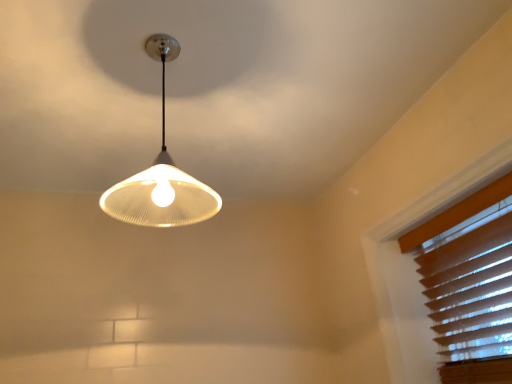
The image size is (512, 384). Describe the element at coordinates (161, 175) in the screenshot. I see `white matte lampshade at upper center` at that location.

Locate an element on the screen. This screenshot has width=512, height=384. white matte lampshade at upper center is located at coordinates (161, 175).

I want to click on brown wood blinds at upper right, so click(x=471, y=285).

Measure the distance between point (x=486, y=263) and camera.

The depth of point (x=486, y=263) is 1.40 meters.

Describe the element at coordinates (471, 285) in the screenshot. I see `brown wood blinds at upper right` at that location.

Where is `white matte lampshade at upper center`? This screenshot has height=384, width=512. white matte lampshade at upper center is located at coordinates (161, 175).

Does white matte lampshade at upper center appear on the left side of brown wood blinds at upper right?

Yes, white matte lampshade at upper center is to the left of brown wood blinds at upper right.

Is white matte lampshade at upper center closer to camera compared to brown wood blinds at upper right?

That is True.

Considering the positions of points (155, 184) and (497, 226), is point (155, 184) farther from camera compared to point (497, 226)?

No, it is in front of (497, 226).

From the image's perspective, is white matte lampshade at upper center above or below brown wood blinds at upper right?

white matte lampshade at upper center is above brown wood blinds at upper right.

From a real-world perspective, is white matte lampshade at upper center physically below brown wood blinds at upper right?

No, from a real-world perspective, white matte lampshade at upper center is not beneath brown wood blinds at upper right.

From the picture: Between white matte lampshade at upper center and brown wood blinds at upper right, which one has larger width?

With larger width is white matte lampshade at upper center.

In terms of height, does white matte lampshade at upper center look taller or shorter compared to brown wood blinds at upper right?

In the image, white matte lampshade at upper center appears to be shorter than brown wood blinds at upper right.

Based on the photo, considering the relative sizes of white matte lampshade at upper center and brown wood blinds at upper right in the image provided, is white matte lampshade at upper center bigger than brown wood blinds at upper right?

Yes, white matte lampshade at upper center is bigger than brown wood blinds at upper right.

Is white matte lampshade at upper center surrounding brown wood blinds at upper right?

That's incorrect, brown wood blinds at upper right is not inside white matte lampshade at upper center.

Based on the photo, is white matte lampshade at upper center in contact with brown wood blinds at upper right?

A: white matte lampshade at upper center and brown wood blinds at upper right are clearly separated.

Does white matte lampshade at upper center turn towards brown wood blinds at upper right?

No, white matte lampshade at upper center is not oriented towards brown wood blinds at upper right.

How distant is white matte lampshade at upper center from brown wood blinds at upper right?

The distance of white matte lampshade at upper center from brown wood blinds at upper right is 38.38 inches.

The height and width of the screenshot is (384, 512). In order to click on blind that appears below the white matte lampshade at upper center (from a real-world perspective) in this screenshot , I will do `click(471, 285)`.

Is brown wood blinds at upper right to the left of white matte lampshade at upper center from the viewer's perspective?

No.

Does brown wood blinds at upper right come in front of white matte lampshade at upper center?

That is False.

Is point (504, 288) closer or farther from the camera than point (210, 207)?

Point (504, 288) is positioned farther from the camera compared to point (210, 207).

From the image's perspective, is brown wood blinds at upper right beneath white matte lampshade at upper center?

Correct, brown wood blinds at upper right appears lower than white matte lampshade at upper center in the image.

From a real-world perspective, is brown wood blinds at upper right over white matte lampshade at upper center?

No, from a real-world perspective, brown wood blinds at upper right is not on top of white matte lampshade at upper center.

Is brown wood blinds at upper right wider than white matte lampshade at upper center?

In fact, brown wood blinds at upper right might be narrower than white matte lampshade at upper center.

Who is taller, brown wood blinds at upper right or white matte lampshade at upper center?

brown wood blinds at upper right.

Can you confirm if brown wood blinds at upper right is smaller than white matte lampshade at upper center?

Yes, brown wood blinds at upper right is smaller than white matte lampshade at upper center.

From the picture: Do you think brown wood blinds at upper right is within white matte lampshade at upper center, or outside of it?

brown wood blinds at upper right is outside white matte lampshade at upper center.

Is brown wood blinds at upper right placed right next to white matte lampshade at upper center?

No, brown wood blinds at upper right is not touching white matte lampshade at upper center.

Could you tell me if brown wood blinds at upper right is facing white matte lampshade at upper center?

Yes, brown wood blinds at upper right faces towards white matte lampshade at upper center.

How different are the orientations of brown wood blinds at upper right and white matte lampshade at upper center in degrees?

brown wood blinds at upper right and white matte lampshade at upper center are facing 90.9 degrees away from each other.

Where is `lamp above the brown wood blinds at upper right (from a real-world perspective)`? lamp above the brown wood blinds at upper right (from a real-world perspective) is located at coordinates click(161, 175).

Find the location of a particular element. The image size is (512, 384). blind behind the white matte lampshade at upper center is located at coordinates (471, 285).

Where is `blind below the white matte lampshade at upper center (from the image's perspective)`? This screenshot has height=384, width=512. blind below the white matte lampshade at upper center (from the image's perspective) is located at coordinates (471, 285).